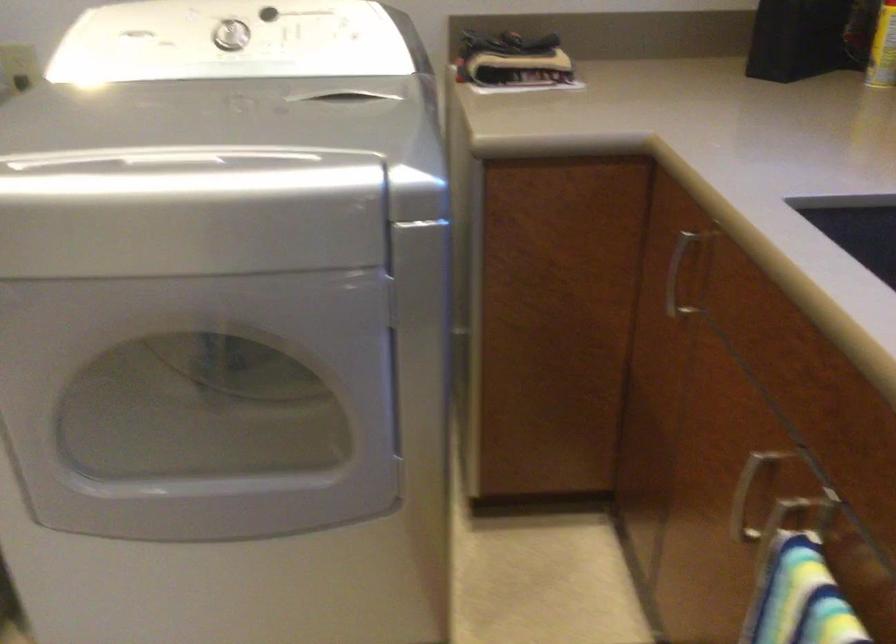
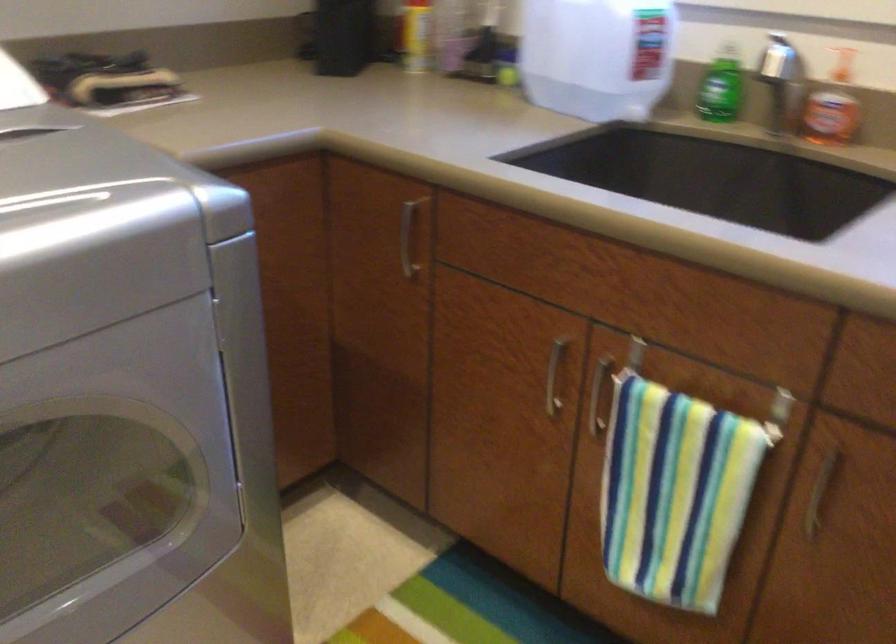
The point at [362,116] is marked in the first image. Where is the corresponding point in the second image?

(73, 155)